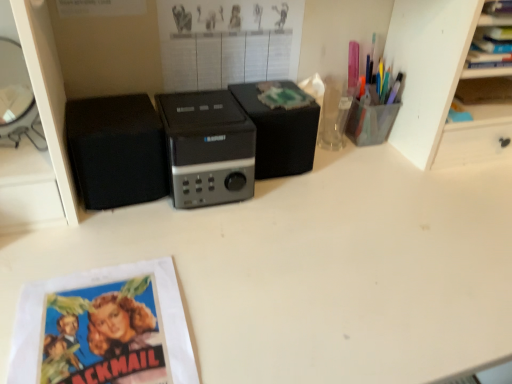
Where is `free space above blue paper at lower left (from a real-world perspective)`? free space above blue paper at lower left (from a real-world perspective) is located at coordinates (106, 331).